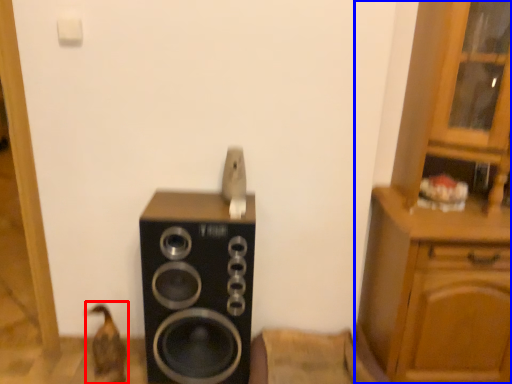
Question: Which of the following is the farthest to the observer, animal (highlighted by a red box) or cabinetry (highlighted by a blue box)?

Choices:
 (A) animal
 (B) cabinetry

Answer: (A)